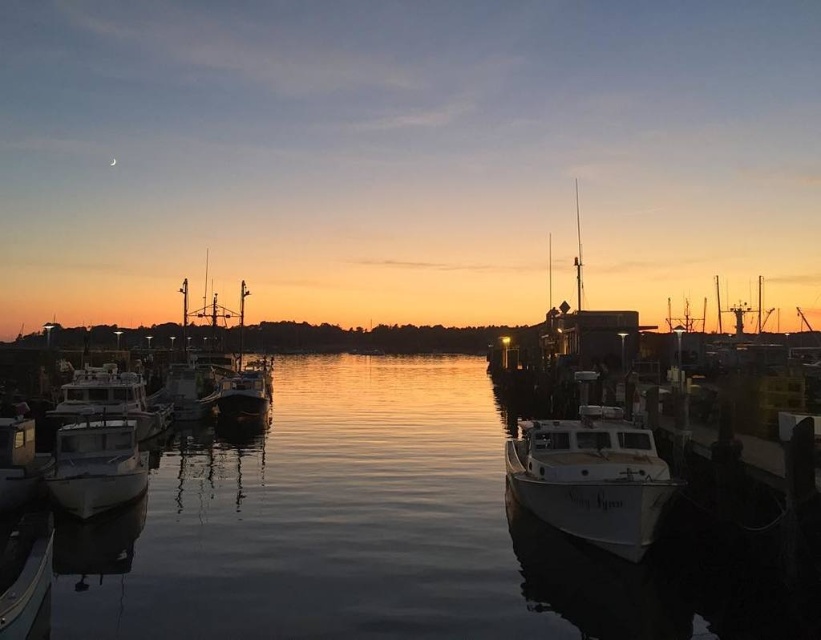
Is the position of metallic white boat at left less distant than that of white matte boat at left?

Yes, metallic white boat at left is closer to the viewer.

Which is in front, point (71, 513) or point (95, 385)?

Point (71, 513) is in front.

The image size is (821, 640). I want to click on metallic white boat at left, so click(x=95, y=467).

Can you confirm if metallic silver boat at center is positioned above white glossy boat at lower left?

Yes.

Between point (163, 390) and point (5, 419), which one is positioned in front?

Point (5, 419)

Where is `metallic silver boat at center`? The image size is (821, 640). metallic silver boat at center is located at coordinates [x=187, y=376].

Between point (654, 467) and point (17, 504), which one is positioned behind?

Point (17, 504)

Who is higher up, white matte boat at center or white glossy boat at lower left?

white matte boat at center is higher up.

Describe the element at coordinates (590, 477) in the screenshot. Image resolution: width=821 pixels, height=640 pixels. I see `white matte boat at center` at that location.

Find the location of a particular element. white matte boat at center is located at coordinates (590, 477).